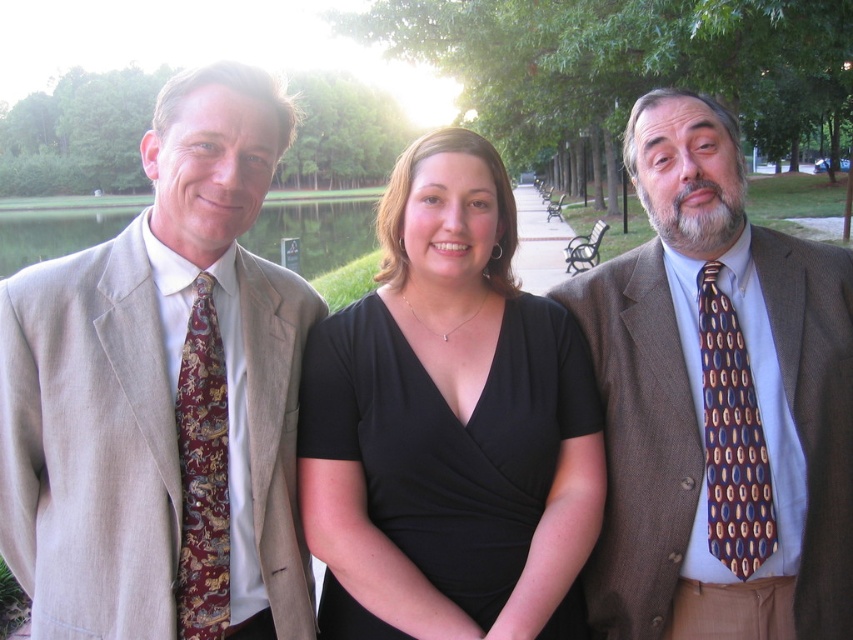
From the picture: Which is more to the right, brown textured suit at right or brown silk tie at right?

brown silk tie at right is more to the right.

Image resolution: width=853 pixels, height=640 pixels. Describe the element at coordinates (718, 403) in the screenshot. I see `brown textured suit at right` at that location.

Which is behind, point (815, 497) or point (706, 378)?

The point (706, 378) is behind.

I want to click on brown textured suit at right, so click(x=718, y=403).

Which of these two, light beige suit at left or black metal park bench at center, stands taller?

black metal park bench at center

Does light beige suit at left have a lesser width compared to black metal park bench at center?

Yes.

Does point (57, 269) come farther from viewer compared to point (581, 257)?

No, it is in front of (581, 257).

The image size is (853, 640). I want to click on light beige suit at left, so click(163, 396).

Is brown textured suit at right taller than black metal park bench at center?

Yes, brown textured suit at right is taller than black metal park bench at center.

Can you confirm if brown textured suit at right is positioned to the right of black metal park bench at center?

In fact, brown textured suit at right is to the left of black metal park bench at center.

Where is `brown textured suit at right`? Image resolution: width=853 pixels, height=640 pixels. brown textured suit at right is located at coordinates pos(718,403).

This screenshot has height=640, width=853. I want to click on brown textured suit at right, so click(718, 403).